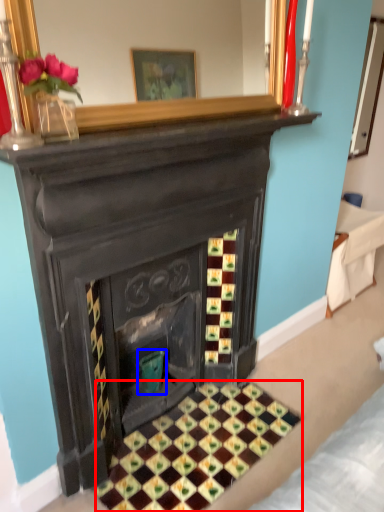
Question: Which point is further to the camera, pattern (highlighted by a red box) or teal (highlighted by a blue box)?

Choices:
 (A) pattern
 (B) teal

Answer: (B)